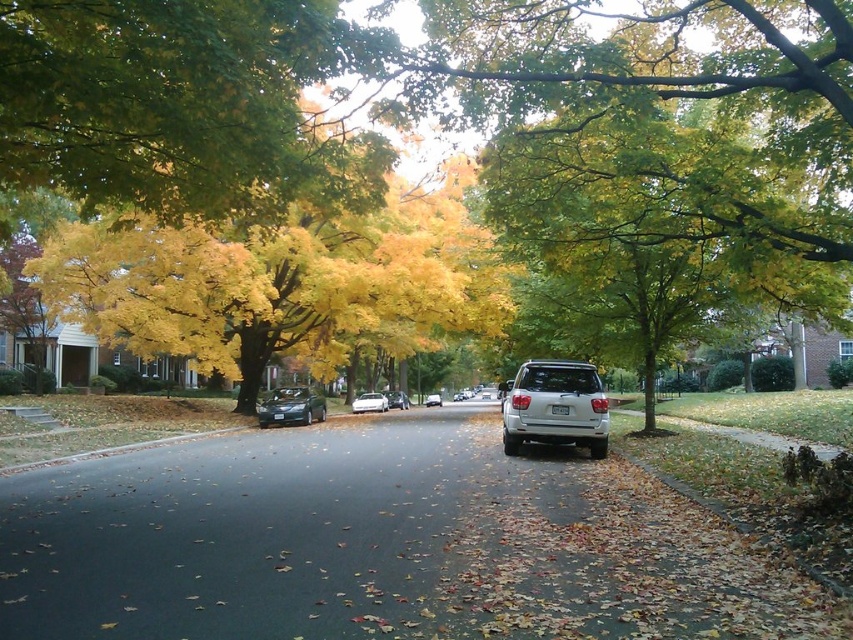
Based on the photo, you are standing at the center of the road and see the point marked at coordinates (555, 403). Based on the scene description, can you determine which object this point is located on?

The point marked at coordinates (555, 403) is located on the white matte suv at center.

You are standing at the point marked by the coordinates point (291,406) in the image. What object are you directly facing?

The point (291,406) marks the shiny black sedan at center, so you are directly facing the shiny black sedan at center.